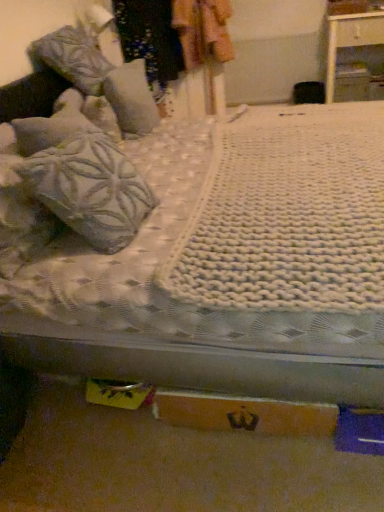
Question: Can you confirm if textured gray pillow at upper left, which is the first pillow from back to front, is wider than white glossy nightstand at upper right?

Choices:
 (A) no
 (B) yes

Answer: (A)

Question: Can you confirm if textured gray pillow at upper left, which is the first pillow from back to front, is thinner than white glossy nightstand at upper right?

Choices:
 (A) yes
 (B) no

Answer: (A)

Question: Is white glossy nightstand at upper right at the back of textured gray pillow at upper left, which is the first pillow from back to front?

Choices:
 (A) no
 (B) yes

Answer: (A)

Question: Is textured gray pillow at upper left, which is the first pillow from back to front, smaller than white glossy nightstand at upper right?

Choices:
 (A) yes
 (B) no

Answer: (A)

Question: Is textured gray pillow at upper left, which is the 2th pillow from front to back, oriented towards white glossy nightstand at upper right?

Choices:
 (A) yes
 (B) no

Answer: (B)

Question: Does textured gray pillow at upper left, which is the 2th pillow from front to back, have a greater height compared to white glossy nightstand at upper right?

Choices:
 (A) yes
 (B) no

Answer: (B)

Question: Can orange cardboard box at lower center be found inside textured gray pillow at upper left, which is the first pillow from back to front?

Choices:
 (A) yes
 (B) no

Answer: (B)

Question: Considering the relative positions of textured gray pillow at upper left, which is the first pillow from back to front, and orange cardboard box at lower center in the image provided, is textured gray pillow at upper left, which is the first pillow from back to front, to the right of orange cardboard box at lower center from the viewer's perspective?

Choices:
 (A) no
 (B) yes

Answer: (A)

Question: Considering the relative sizes of textured gray pillow at upper left, which is the 2th pillow from front to back, and orange cardboard box at lower center in the image provided, is textured gray pillow at upper left, which is the 2th pillow from front to back, bigger than orange cardboard box at lower center?

Choices:
 (A) yes
 (B) no

Answer: (A)

Question: Does textured gray pillow at upper left, which is the 2th pillow from front to back, lie behind orange cardboard box at lower center?

Choices:
 (A) yes
 (B) no

Answer: (A)

Question: Is textured gray pillow at upper left, which is the 2th pillow from front to back, taller than orange cardboard box at lower center?

Choices:
 (A) no
 (B) yes

Answer: (B)

Question: Is textured gray pillow at upper left, which is the first pillow from back to front, located outside orange cardboard box at lower center?

Choices:
 (A) no
 (B) yes

Answer: (B)

Question: Considering the relative sizes of white knitted blanket at center and orange cardboard box at lower center in the image provided, is white knitted blanket at center thinner than orange cardboard box at lower center?

Choices:
 (A) no
 (B) yes

Answer: (A)